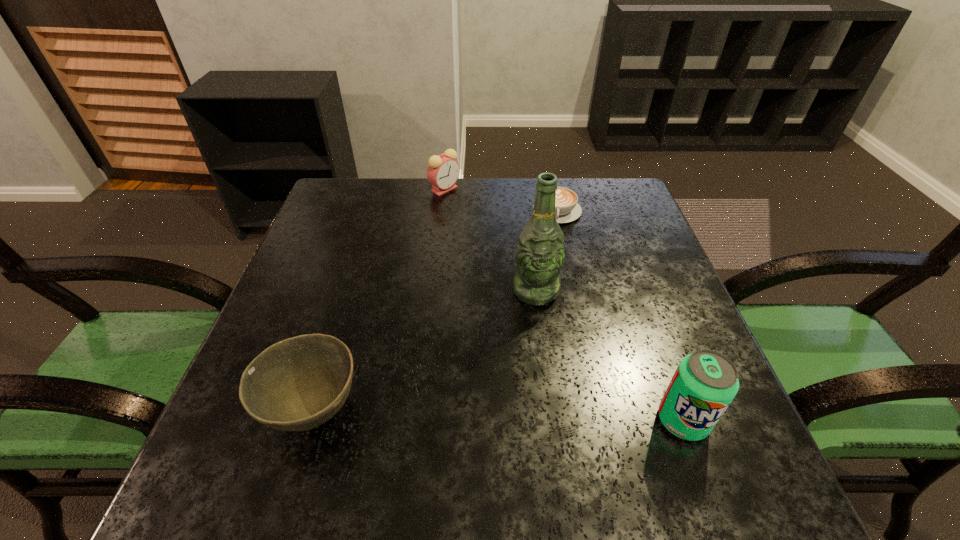
You are a GUI agent. You are given a task and a screenshot of the screen. Output one action in this format:
    pyautogui.click(x=<x>, y=<y>)
    Task: Click on the alarm clock that is at the far edge
    The width and height of the screenshot is (960, 540).
    Given the screenshot: What is the action you would take?
    pyautogui.click(x=443, y=171)

Find the location of a particular element. bowl that is at the near edge is located at coordinates (297, 384).

Identify the location of pop soda that is at the near edge. This screenshot has width=960, height=540. (705, 382).

Identify the location of object present at the left edge. (297, 384).

You are a GUI agent. You are given a task and a screenshot of the screen. Output one action in this format:
    pyautogui.click(x=<x>, y=<y>)
    Task: Click on the object that is at the right edge
    
    Given the screenshot: What is the action you would take?
    pyautogui.click(x=705, y=382)

Locate an element on the screen. object that is at the near left corner is located at coordinates pyautogui.click(x=297, y=384).

Locate an element on the screen. The image size is (960, 540). object located at the near right corner is located at coordinates pos(705,382).

Locate an element on the screen. The height and width of the screenshot is (540, 960). free space at the far edge of the desktop is located at coordinates (411, 197).

Find the location of a particular element. vacant position at the near edge of the desktop is located at coordinates (645, 435).

This screenshot has height=540, width=960. Identify the location of vacant space at the left edge of the desktop. (345, 294).